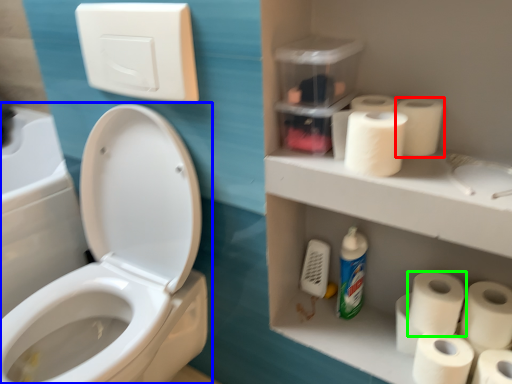
Question: Estimate the real-world distances between objects in this image. Which object is closer to toilet paper (highlighted by a red box), toilet (highlighted by a blue box) or toilet paper (highlighted by a green box)?

Choices:
 (A) toilet
 (B) toilet paper

Answer: (B)